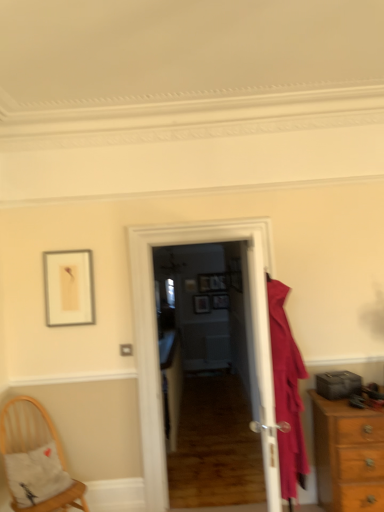
What do you see at coordinates (220, 301) in the screenshot?
I see `matte wooden picture frame at center, which is the first picture frame from right to left` at bounding box center [220, 301].

What are the coordinates of `matte wooden picture frame at center, placed as the 4th picture frame when sorted from left to right` in the screenshot? It's located at (220, 301).

The height and width of the screenshot is (512, 384). What do you see at coordinates (201, 304) in the screenshot?
I see `matte wooden picture frame at center, which appears as the 3th picture frame when viewed from the right` at bounding box center [201, 304].

The image size is (384, 512). Find the location of `light brown wooden chest of drawers at right`. light brown wooden chest of drawers at right is located at coordinates (348, 456).

The image size is (384, 512). Find the location of `woven wood chair at lower left`. woven wood chair at lower left is located at coordinates (36, 460).

Find the location of `matte wooden picture frame at center, placed as the 4th picture frame when sorted from left to right`. matte wooden picture frame at center, placed as the 4th picture frame when sorted from left to right is located at coordinates (220, 301).

From a real-world perspective, which picture frame is the 2nd one underneath the wooden picture frame at center, arranged as the third picture frame when viewed from the left? Please provide its 2D coordinates.

[(201, 304)]

From a real-world perspective, which object stands above the other?

wooden picture frame at center, which is the second picture frame from right to left.

Which is correct: wooden picture frame at center, arranged as the third picture frame when viewed from the left, is inside matte wooden picture frame at center, the second picture frame in the left-to-right sequence, or outside of it?

wooden picture frame at center, arranged as the third picture frame when viewed from the left, exists outside the volume of matte wooden picture frame at center, the second picture frame in the left-to-right sequence.

In terms of height, does white glossy door at center, placed as the first door when sorted from back to front, look taller or shorter compared to white glossy door at center, the first door from the front?

Clearly, white glossy door at center, placed as the first door when sorted from back to front, is taller compared to white glossy door at center, the first door from the front.

From a real-world perspective, between white glossy door at center, placed as the first door when sorted from back to front, and white glossy door at center, positioned as the 2th door in back-to-front order, who is vertically higher?

white glossy door at center, placed as the first door when sorted from back to front.

Where is `door behind the white glossy door at center, positioned as the 2th door in back-to-front order`? door behind the white glossy door at center, positioned as the 2th door in back-to-front order is located at coordinates (157, 345).

Which of these two, white glossy door at center, placed as the first door when sorted from back to front, or white glossy door at center, the first door from the front, is thinner?

Thinner between the two is white glossy door at center, the first door from the front.

Between point (260, 326) and point (282, 337), which one is positioned behind?

The point (282, 337) is farther.

Is white glossy door at center, the first door from the front, outside of matte pink coat at right?

No, white glossy door at center, the first door from the front, is not entirely external to matte pink coat at right.

Looking at their sizes, would you say white glossy door at center, the first door from the front, is wider or thinner than matte pink coat at right?

Considering their sizes, white glossy door at center, the first door from the front, looks slimmer than matte pink coat at right.

Is white glossy door at center, the first door from the front, turned away from matte pink coat at right?

Yes, matte pink coat at right is at the back of white glossy door at center, the first door from the front.

Looking at this image, how different are the orientations of matte gold picture frame at center, arranged as the fourth picture frame when viewed from the right, and white glossy door at center, placed as the first door when sorted from back to front, in degrees?

They differ by 1.13 degrees in their facing directions.

Between matte gold picture frame at center, which is the first picture frame in left-to-right order, and white glossy door at center, which is counted as the 2th door, starting from the front, which one is positioned in front?

Positioned in front is white glossy door at center, which is counted as the 2th door, starting from the front.

Which of these two, matte gold picture frame at center, which is the first picture frame in left-to-right order, or white glossy door at center, which is counted as the 2th door, starting from the front, stands taller?

white glossy door at center, which is counted as the 2th door, starting from the front.

From the image's perspective, is matte gold picture frame at center, arranged as the fourth picture frame when viewed from the right, located above or below white glossy door at center, which is counted as the 2th door, starting from the front?

Clearly, from the image's perspective, matte gold picture frame at center, arranged as the fourth picture frame when viewed from the right, is above white glossy door at center, which is counted as the 2th door, starting from the front.

Which of these two, light brown wooden chest of drawers at right or matte gold picture frame at center, which is the first picture frame in left-to-right order, is smaller?

matte gold picture frame at center, which is the first picture frame in left-to-right order.

Is light brown wooden chest of drawers at right shorter than matte gold picture frame at center, which is the first picture frame in left-to-right order?

No, light brown wooden chest of drawers at right is not shorter than matte gold picture frame at center, which is the first picture frame in left-to-right order.

From the image's perspective, count 3rd picture frames upward from the light brown wooden chest of drawers at right and point to it. Please provide its 2D coordinates.

[(190, 285)]

Is light brown wooden chest of drawers at right inside or outside of matte gold picture frame at center, arranged as the fourth picture frame when viewed from the right?

The correct answer is: outside.

Can you confirm if white glossy door at center, the first door from the front, is bigger than matte wooden picture frame at center, which appears as the 3th picture frame when viewed from the right?

Indeed, white glossy door at center, the first door from the front, has a larger size compared to matte wooden picture frame at center, which appears as the 3th picture frame when viewed from the right.

Which door is the 2nd one when counting from the front of the matte wooden picture frame at center, the second picture frame in the left-to-right sequence? Please provide its 2D coordinates.

[(262, 365)]

Is white glossy door at center, positioned as the 2th door in back-to-front order, facing away from matte wooden picture frame at center, the second picture frame in the left-to-right sequence?

white glossy door at center, positioned as the 2th door in back-to-front order, does not have its back to matte wooden picture frame at center, the second picture frame in the left-to-right sequence.

Which is farther, (273, 462) or (205, 312)?

Point (205, 312)

From a real-world perspective, which is physically below, matte wooden picture frame at center, which is the first picture frame from right to left, or white glossy door at center, positioned as the 2th door in back-to-front order?

From a 3D spatial view, matte wooden picture frame at center, which is the first picture frame from right to left, is below.

Which of these two, matte wooden picture frame at center, placed as the 4th picture frame when sorted from left to right, or white glossy door at center, positioned as the 2th door in back-to-front order, is wider?

Wider between the two is white glossy door at center, positioned as the 2th door in back-to-front order.

Would you say matte wooden picture frame at center, which is the first picture frame from right to left, is to the left or to the right of white glossy door at center, positioned as the 2th door in back-to-front order, in the picture?

Based on their positions, matte wooden picture frame at center, which is the first picture frame from right to left, is located to the right of white glossy door at center, positioned as the 2th door in back-to-front order.

Is matte wooden picture frame at center, which is the first picture frame from right to left, far from white glossy door at center, positioned as the 2th door in back-to-front order?

That's right, there is a large distance between matte wooden picture frame at center, which is the first picture frame from right to left, and white glossy door at center, positioned as the 2th door in back-to-front order.

You are a GUI agent. You are given a task and a screenshot of the screen. Output one action in this format:
    pyautogui.click(x=<x>, y=<y>)
    Task: Click on the 3rd picture frame positioned above the matte wooden picture frame at center, which appears as the 3th picture frame when viewed from the right (from the image's perspective)
    
    Given the screenshot: What is the action you would take?
    pyautogui.click(x=213, y=282)

At what (x,y) coordinates should I click in order to perform the action: click on door that is below the white glossy door at center, which is counted as the 2th door, starting from the front (from the image's perspective). Please return your answer as a coordinate pair (x, y). Looking at the image, I should click on (262, 365).

Based on their spatial positions, is light brown wooden chest of drawers at right or white glossy door at center, the first door from the front, closer to matte wooden picture frame at center, which is the first picture frame from right to left?

light brown wooden chest of drawers at right is positioned closer to the anchor matte wooden picture frame at center, which is the first picture frame from right to left.

When comparing their distances from matte wooden picture frame at center, placed as the 4th picture frame when sorted from left to right, does light brown wooden chest of drawers at right or woven wood chair at lower left seem further?

woven wood chair at lower left lies further to matte wooden picture frame at center, placed as the 4th picture frame when sorted from left to right, than the other object.

When comparing their distances from wooden picture frame at center, which is the second picture frame from right to left, does matte pink coat at right or white glossy door at center, positioned as the 2th door in back-to-front order, seem closer?

Among the two, white glossy door at center, positioned as the 2th door in back-to-front order, is located nearer to wooden picture frame at center, which is the second picture frame from right to left.

Based on their spatial positions, is light brown wooden chest of drawers at right or matte wooden picture frame at center, placed as the 4th picture frame when sorted from left to right, further from woven wood chair at lower left?

matte wooden picture frame at center, placed as the 4th picture frame when sorted from left to right, lies further to woven wood chair at lower left than the other object.

From the image, which object appears to be farther from white glossy door at center, which is counted as the 2th door, starting from the front, matte wooden picture frame at center, which is the first picture frame from right to left, or light brown wooden chest of drawers at right?

Among the two, matte wooden picture frame at center, which is the first picture frame from right to left, is located further to white glossy door at center, which is counted as the 2th door, starting from the front.

When comparing their distances from wooden picture frame at center, which is the second picture frame from right to left, does matte gold picture frame at center, which is the first picture frame in left-to-right order, or matte pink coat at right seem closer?

The object closer to wooden picture frame at center, which is the second picture frame from right to left, is matte gold picture frame at center, which is the first picture frame in left-to-right order.

When comparing their distances from matte gold picture frame at center, which is the first picture frame in left-to-right order, does matte wooden picture frame at center, which is the first picture frame from right to left, or light brown wooden chest of drawers at right seem closer?

Among the two, matte wooden picture frame at center, which is the first picture frame from right to left, is located nearer to matte gold picture frame at center, which is the first picture frame in left-to-right order.

Estimate the real-world distances between objects in this image. Which object is closer to matte wooden picture frame at center, the second picture frame in the left-to-right sequence, matte pink coat at right or light brown wooden chest of drawers at right?

Among the two, light brown wooden chest of drawers at right is located nearer to matte wooden picture frame at center, the second picture frame in the left-to-right sequence.

Find the location of a particular element. This screenshot has height=512, width=384. clothing located between white glossy door at center, the first door from the front, and matte gold picture frame at center, which is the first picture frame in left-to-right order, in the depth direction is located at coordinates (287, 392).

This screenshot has width=384, height=512. What are the coordinates of `chest of drawers between woven wood chair at lower left and matte wooden picture frame at center, placed as the 4th picture frame when sorted from left to right, along the z-axis` in the screenshot? It's located at (348, 456).

Where is `chest of drawers between woven wood chair at lower left and matte gold picture frame at center, arranged as the fourth picture frame when viewed from the right, along the z-axis`? chest of drawers between woven wood chair at lower left and matte gold picture frame at center, arranged as the fourth picture frame when viewed from the right, along the z-axis is located at coordinates (348, 456).

You are a GUI agent. You are given a task and a screenshot of the screen. Output one action in this format:
    pyautogui.click(x=<x>, y=<y>)
    Task: Click on the clothing located between white glossy door at center, the first door from the front, and wooden picture frame at center, which is the second picture frame from right to left, in the depth direction
    
    Given the screenshot: What is the action you would take?
    pyautogui.click(x=287, y=392)